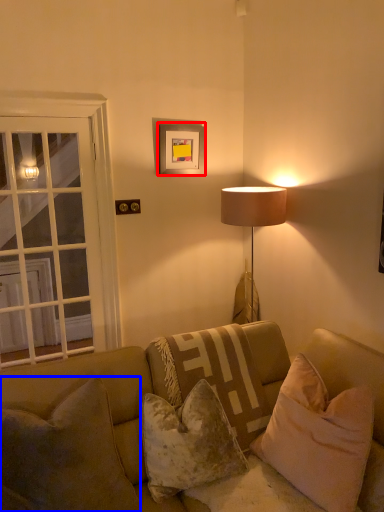
Question: Which point is further to the camera, picture frame (highlighted by a red box) or pillow (highlighted by a blue box)?

Choices:
 (A) picture frame
 (B) pillow

Answer: (A)